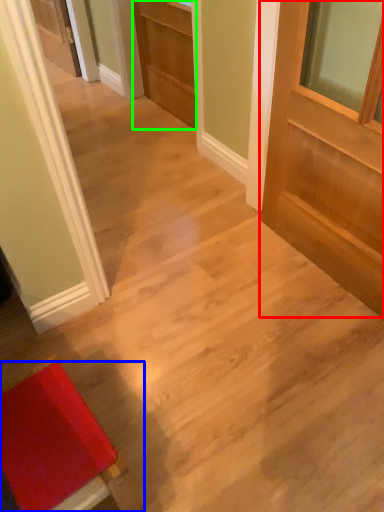
Question: Considering the real-world distances, which object is farthest from door (highlighted by a red box)? furniture (highlighted by a blue box) or door (highlighted by a green box)?

Choices:
 (A) furniture
 (B) door

Answer: (A)